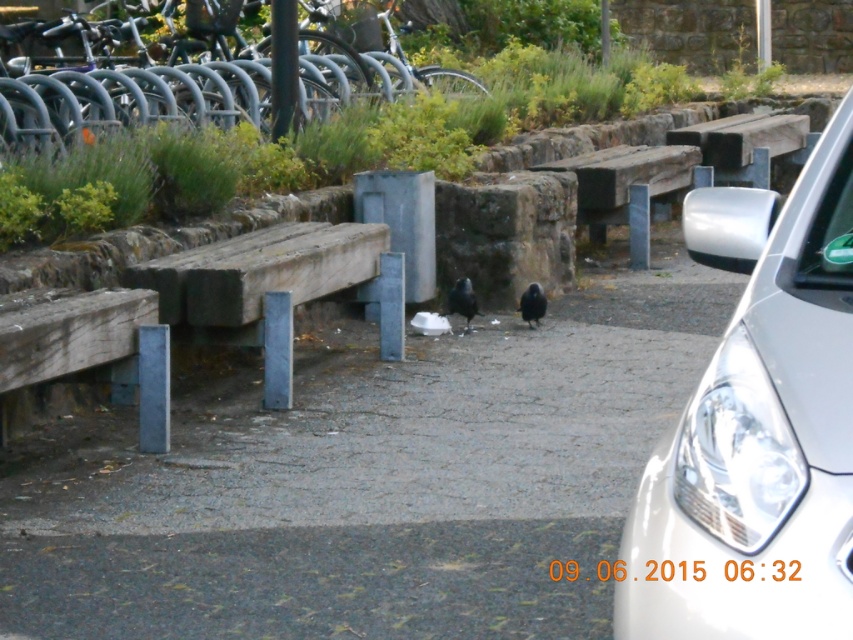
Question: Does white glossy car at right have a smaller size compared to weathered wood bench at center?

Choices:
 (A) no
 (B) yes

Answer: (B)

Question: Which point appears farthest from the camera in this image?

Choices:
 (A) (460, 304)
 (B) (4, 380)
 (C) (525, 308)

Answer: (C)

Question: Is white glossy car at right to the left of weathered wood bench at lower left from the viewer's perspective?

Choices:
 (A) no
 (B) yes

Answer: (A)

Question: Which of the following is the closest to the observer?

Choices:
 (A) white glossy car at right
 (B) wooden bench at center
 (C) black matte pigeon at center

Answer: (C)

Question: Which object is positioned farthest from the wooden bench at center?

Choices:
 (A) black matte pigeon at center
 (B) weathered wood bench at center

Answer: (B)

Question: Where is weathered wood bench at lower left located in relation to wooden bench at center in the image?

Choices:
 (A) left
 (B) right

Answer: (A)